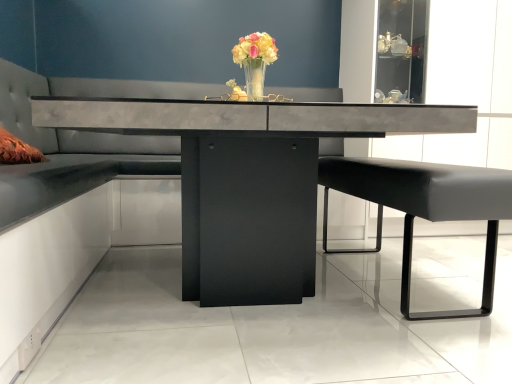
Question: Considering the positions of concrete table at center and translucent glass vase at center in the image, is concrete table at center bigger or smaller than translucent glass vase at center?

Choices:
 (A) big
 (B) small

Answer: (A)

Question: Is concrete table at center inside or outside of translucent glass vase at center?

Choices:
 (A) outside
 (B) inside

Answer: (A)

Question: Estimate the real-world distances between objects in this image. Which object is farther from the black leather bench at right?

Choices:
 (A) tufted leather couch at center
 (B) concrete table at center
 (C) translucent glass vase at center

Answer: (A)

Question: Which object is positioned closest to the concrete table at center?

Choices:
 (A) tufted leather couch at center
 (B) translucent glass vase at center
 (C) black leather bench at right

Answer: (C)